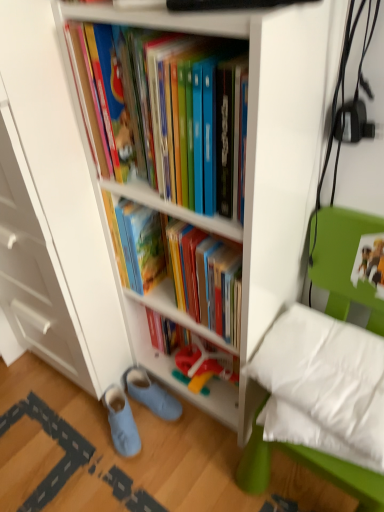
This screenshot has width=384, height=512. Describe the element at coordinates (246, 160) in the screenshot. I see `white glossy bookcase at center` at that location.

This screenshot has height=512, width=384. Identify the location of blue suede slippers at lower left, arranged as the second footwear when viewed from the left. (151, 394).

Describe the element at coordinates (173, 117) in the screenshot. The width and height of the screenshot is (384, 512). I see `matte plastic books at center, the 1th book positioned from the top` at that location.

Measure the distance between white soft pillow at lower right and camera.

A distance of 30.68 inches exists between white soft pillow at lower right and camera.

What do you see at coordinates (121, 422) in the screenshot?
I see `light blue fabric slippers at lower left, placed as the 1th footwear when sorted from left to right` at bounding box center [121, 422].

I want to click on light blue fabric slippers at lower left, placed as the 1th footwear when sorted from left to right, so click(x=121, y=422).

Where is `white glossy bookcase at center`? The width and height of the screenshot is (384, 512). white glossy bookcase at center is located at coordinates (246, 160).

Based on their sizes in the image, would you say blue suede slippers at lower left, the 1th footwear positioned from the right, is bigger or smaller than matte plastic books at center, the second book ordered from the bottom?

blue suede slippers at lower left, the 1th footwear positioned from the right, is smaller than matte plastic books at center, the second book ordered from the bottom.

From the image's perspective, which one is positioned lower, blue suede slippers at lower left, the 1th footwear positioned from the right, or matte plastic books at center, the second book ordered from the bottom?

From the image's view, blue suede slippers at lower left, the 1th footwear positioned from the right, is below.

Is blue suede slippers at lower left, the 1th footwear positioned from the right, positioned beyond the bounds of matte plastic books at center, the second book ordered from the bottom?

blue suede slippers at lower left, the 1th footwear positioned from the right, lies outside matte plastic books at center, the second book ordered from the bottom,'s area.

Does point (135, 387) appear closer or farther from the camera than point (191, 110)?

Point (135, 387) is positioned farther from the camera compared to point (191, 110).

From a real-world perspective, is matte plastic books at center, the second book ordered from the bottom, above or below white soft pillow at lower right?

Clearly, from a real-world perspective, matte plastic books at center, the second book ordered from the bottom, is above white soft pillow at lower right.

Can you tell me how much matte plastic books at center, the second book ordered from the bottom, and white soft pillow at lower right differ in facing direction?

The angle between the facing direction of matte plastic books at center, the second book ordered from the bottom, and the facing direction of white soft pillow at lower right is 9.85 degrees.

From the image's perspective, is matte plastic books at center, the 1th book positioned from the top, positioned above or below white soft pillow at lower right?

matte plastic books at center, the 1th book positioned from the top, is above white soft pillow at lower right.

Could white soft pillow at lower right be considered to be inside matte plastic books at center, the second book ordered from the bottom?

No.

Does matte plastic shelf at center turn towards light blue fabric slippers at lower left, placed as the 1th footwear when sorted from left to right?

No, matte plastic shelf at center is not aimed at light blue fabric slippers at lower left, placed as the 1th footwear when sorted from left to right.

In the image, is matte plastic shelf at center positioned in front of or behind light blue fabric slippers at lower left, placed as the 1th footwear when sorted from left to right?

matte plastic shelf at center is in front of light blue fabric slippers at lower left, placed as the 1th footwear when sorted from left to right.

Based on their sizes in the image, would you say matte plastic shelf at center is bigger or smaller than light blue fabric slippers at lower left, placed as the 1th footwear when sorted from left to right?

Considering their sizes, matte plastic shelf at center takes up more space than light blue fabric slippers at lower left, placed as the 1th footwear when sorted from left to right.

Is point (163, 416) closer to viewer compared to point (209, 341)?

No, (163, 416) is behind (209, 341).

Considering the relative positions of blue suede slippers at lower left, the 1th footwear positioned from the right, and hardcover books at center, which is the second book from top to bottom, in the image provided, is blue suede slippers at lower left, the 1th footwear positioned from the right, to the left or to the right of hardcover books at center, which is the second book from top to bottom,?

Clearly, blue suede slippers at lower left, the 1th footwear positioned from the right, is on the left of hardcover books at center, which is the second book from top to bottom, in the image.

Does blue suede slippers at lower left, arranged as the second footwear when viewed from the left, have a lesser height compared to hardcover books at center, which is the second book from top to bottom?

Correct, blue suede slippers at lower left, arranged as the second footwear when viewed from the left, is not as tall as hardcover books at center, which is the second book from top to bottom.

In the image, is white glossy bookcase at center positioned in front of or behind light blue fabric slippers at lower left, placed as the 1th footwear when sorted from left to right?

Clearly, white glossy bookcase at center is in front of light blue fabric slippers at lower left, placed as the 1th footwear when sorted from left to right.

From a real-world perspective, between white glossy bookcase at center and light blue fabric slippers at lower left, placed as the 1th footwear when sorted from left to right, who is vertically higher?

In real-world perspective, white glossy bookcase at center is above.

Can we say white glossy bookcase at center lies outside light blue fabric slippers at lower left, the 2th footwear when ordered from right to left?

Indeed, white glossy bookcase at center is completely outside light blue fabric slippers at lower left, the 2th footwear when ordered from right to left.

Does light blue fabric slippers at lower left, placed as the 1th footwear when sorted from left to right, have a larger size compared to matte plastic shelf at center?

Actually, light blue fabric slippers at lower left, placed as the 1th footwear when sorted from left to right, might be smaller than matte plastic shelf at center.

Considering the sizes of objects light blue fabric slippers at lower left, the 2th footwear when ordered from right to left, and matte plastic shelf at center in the image provided, who is thinner, light blue fabric slippers at lower left, the 2th footwear when ordered from right to left, or matte plastic shelf at center?

Thinner between the two is matte plastic shelf at center.

Which is closer, (187, 321) or (210, 408)?

Clearly, point (187, 321) is closer to the camera than point (210, 408).

What's the angular difference between matte plastic shelf at center and white glossy bookcase at center's facing directions?

They differ by 0.762 degrees in their facing directions.

Could you tell me if matte plastic shelf at center is facing white glossy bookcase at center?

Yes, matte plastic shelf at center faces towards white glossy bookcase at center.

Locate an element on the screen. the 2nd book above the blue suede slippers at lower left, the 1th footwear positioned from the right (from the image's perspective) is located at coordinates (173, 117).

Locate an element on the screen. This screenshot has width=384, height=512. pillow behind the matte plastic books at center, the 1th book positioned from the top is located at coordinates (323, 386).

From the image, which object appears to be farther from blue suede slippers at lower left, the 1th footwear positioned from the right, light blue fabric slippers at lower left, the 2th footwear when ordered from right to left, or matte plastic books at center, the 1th book positioned from the top?

matte plastic books at center, the 1th book positioned from the top, is further to blue suede slippers at lower left, the 1th footwear positioned from the right.

Considering their positions, is blue suede slippers at lower left, the 1th footwear positioned from the right, positioned closer to white glossy bookcase at center than light blue fabric slippers at lower left, the 2th footwear when ordered from right to left?

Based on the image, blue suede slippers at lower left, the 1th footwear positioned from the right, appears to be nearer to white glossy bookcase at center.

When comparing their distances from hardcover books at center, positioned as the first book in bottom-to-top order, does white glossy bookcase at center or light blue fabric slippers at lower left, the 2th footwear when ordered from right to left, seem further?

light blue fabric slippers at lower left, the 2th footwear when ordered from right to left.

From the image, which object appears to be farther from blue suede slippers at lower left, the 1th footwear positioned from the right, hardcover books at center, which is the second book from top to bottom, or matte plastic shelf at center?

The object further to blue suede slippers at lower left, the 1th footwear positioned from the right, is hardcover books at center, which is the second book from top to bottom.

Considering their positions, is blue suede slippers at lower left, the 1th footwear positioned from the right, positioned closer to hardcover books at center, positioned as the first book in bottom-to-top order, than matte plastic shelf at center?

matte plastic shelf at center.

Considering their positions, is white soft pillow at lower right positioned further to matte plastic shelf at center than white glossy bookcase at center?

The object further to matte plastic shelf at center is white soft pillow at lower right.

Based on their spatial positions, is matte plastic books at center, the 1th book positioned from the top, or matte plastic shelf at center further from hardcover books at center, positioned as the first book in bottom-to-top order?

matte plastic books at center, the 1th book positioned from the top, lies further to hardcover books at center, positioned as the first book in bottom-to-top order, than the other object.

Based on their spatial positions, is white soft pillow at lower right or light blue fabric slippers at lower left, the 2th footwear when ordered from right to left, further from matte plastic books at center, the 1th book positioned from the top?

Among the two, light blue fabric slippers at lower left, the 2th footwear when ordered from right to left, is located further to matte plastic books at center, the 1th book positioned from the top.

This screenshot has width=384, height=512. Identify the location of book between matte plastic books at center, the 1th book positioned from the top, and matte plastic shelf at center vertically. (176, 312).

Identify the location of book between matte plastic books at center, the 1th book positioned from the top, and blue suede slippers at lower left, the 1th footwear positioned from the right, vertically. (176, 312).

Find the location of a particular element. The height and width of the screenshot is (512, 384). footwear that lies between hardcover books at center, which is the second book from top to bottom, and light blue fabric slippers at lower left, the 2th footwear when ordered from right to left, from top to bottom is located at coordinates (151, 394).

You are a GUI agent. You are given a task and a screenshot of the screen. Output one action in this format:
    pyautogui.click(x=<x>, y=<y>)
    Task: Click on the shelf located between white glossy bookcase at center and blue suede slippers at lower left, the 1th footwear positioned from the right, in the depth direction
    Image resolution: width=384 pixels, height=512 pixels.
    Given the screenshot: What is the action you would take?
    pyautogui.click(x=174, y=353)